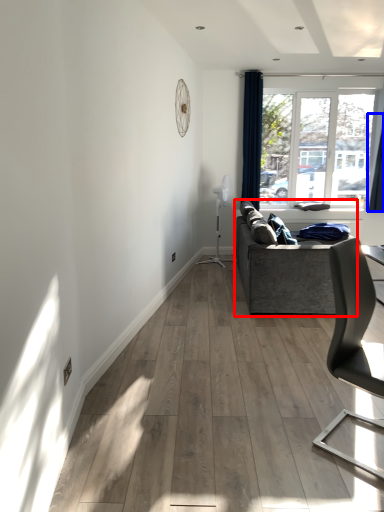
Question: Which point is closer to the camera, studio couch (highlighted by a red box) or curtain (highlighted by a blue box)?

Choices:
 (A) studio couch
 (B) curtain

Answer: (A)